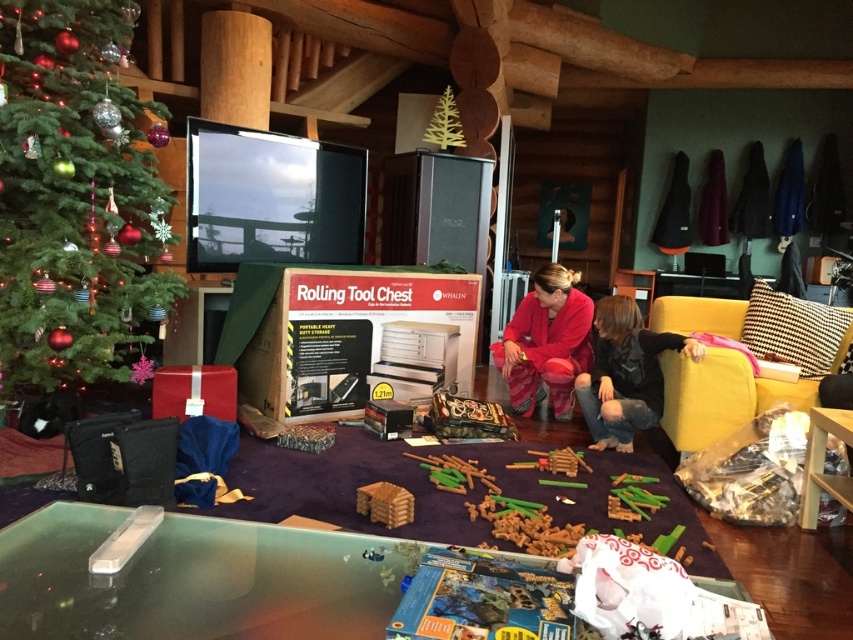
Question: Does green matte christmas tree at upper left appear on the right side of black cotton shirt at lower right?

Choices:
 (A) yes
 (B) no

Answer: (B)

Question: Among these objects, which one is farthest from the camera?

Choices:
 (A) green matte christmas tree at upper left
 (B) velvet red pants at center
 (C) green matte christmas tree at upper center
 (D) black cotton shirt at lower right

Answer: (C)

Question: Does black cotton shirt at lower right appear over velvet red pants at center?

Choices:
 (A) no
 (B) yes

Answer: (A)

Question: Is green matte christmas tree at upper left behind green matte christmas tree at upper center?

Choices:
 (A) yes
 (B) no

Answer: (B)

Question: Among these points, which one is nearest to the camera?

Choices:
 (A) (434, 141)
 (B) (138, 216)
 (C) (631, 316)

Answer: (B)

Question: Which object is positioned farthest from the velvet red pants at center?

Choices:
 (A) black cotton shirt at lower right
 (B) green matte christmas tree at upper center

Answer: (B)